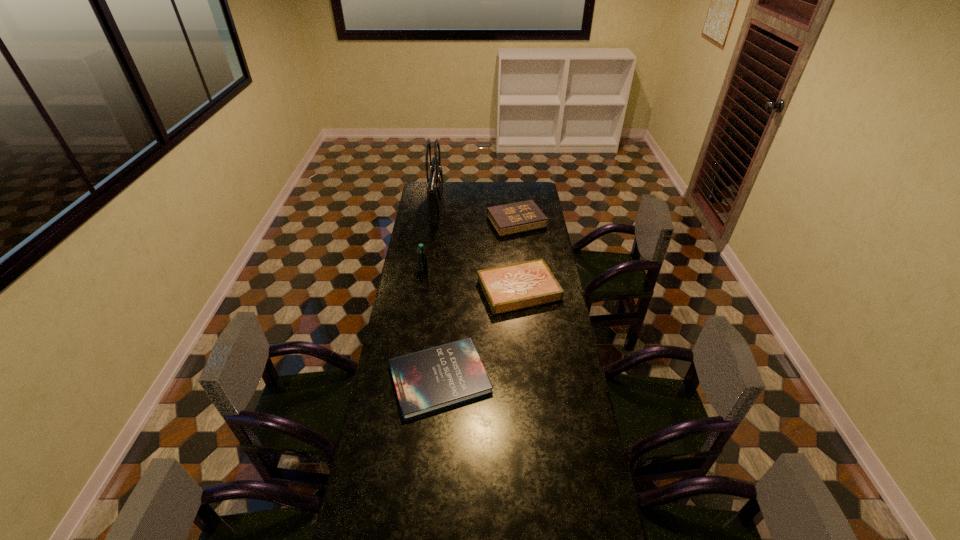
Image resolution: width=960 pixels, height=540 pixels. What are the coordinates of `vacant area that lies between the handbag and the nearest object` in the screenshot? It's located at (439, 293).

This screenshot has height=540, width=960. Identify the location of blank region between the third shortest object and the tallest object. (477, 215).

At what (x,y) coordinates should I click in order to perform the action: click on vacant space that's between the second nearest hardback book and the nearest object. Please return your answer as a coordinate pair (x, y). This screenshot has height=540, width=960. Looking at the image, I should click on (479, 334).

Where is `free space between the handbag and the nearest hardback book`? free space between the handbag and the nearest hardback book is located at coordinates (439, 293).

Image resolution: width=960 pixels, height=540 pixels. In order to click on unoccupied position between the handbag and the nearest hardback book in this screenshot , I will do `click(439, 293)`.

Identify the location of vacant space that is in between the second nearest hardback book and the shortest object. The height and width of the screenshot is (540, 960). (479, 334).

I want to click on the fourth closest object to the second shortest object, so click(x=435, y=180).

Identify which object is located as the nearest to the second farthest hardback book. Please provide its 2D coordinates. Your answer should be formatted as a tuple, i.e. [(x, y)], where the tuple contains the x and y coordinates of a point satisfying the conditions above.

[(426, 381)]

Identify which hardback book is the nearest to the second tallest hardback book. Please provide its 2D coordinates. Your answer should be formatted as a tuple, i.e. [(x, y)], where the tuple contains the x and y coordinates of a point satisfying the conditions above.

[(426, 381)]

Select which hardback book is the second closest to the second shortest object. Please provide its 2D coordinates. Your answer should be formatted as a tuple, i.e. [(x, y)], where the tuple contains the x and y coordinates of a point satisfying the conditions above.

[(524, 216)]